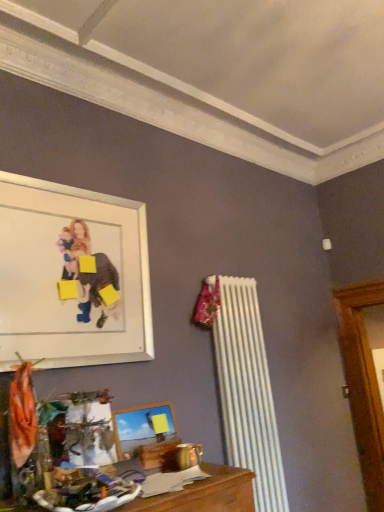
The image size is (384, 512). In order to click on wooden picture frame at lower center, which ranks as the 2th picture frame in top-to-bottom order in this screenshot , I will do `click(142, 426)`.

The width and height of the screenshot is (384, 512). What do you see at coordinates (142, 426) in the screenshot?
I see `wooden picture frame at lower center, which ranks as the 2th picture frame in top-to-bottom order` at bounding box center [142, 426].

Locate an element on the screen. white matte picture frame at upper left, marked as the first picture frame in a top-to-bottom arrangement is located at coordinates (71, 276).

What do you see at coordinates (71, 276) in the screenshot? I see `white matte picture frame at upper left, the second picture frame when ordered from bottom to top` at bounding box center [71, 276].

Where is `wooden picture frame at lower center, which ranks as the 2th picture frame in top-to-bottom order`? The image size is (384, 512). wooden picture frame at lower center, which ranks as the 2th picture frame in top-to-bottom order is located at coordinates (142, 426).

Is white matte picture frame at upper left, marked as the first picture frame in a top-to-bottom arrangement, to the right of wooden picture frame at lower center, which is the 1th picture frame from bottom to top, from the viewer's perspective?

No, white matte picture frame at upper left, marked as the first picture frame in a top-to-bottom arrangement, is not to the right of wooden picture frame at lower center, which is the 1th picture frame from bottom to top.

Is white matte picture frame at upper left, marked as the first picture frame in a top-to-bottom arrangement, behind wooden picture frame at lower center, which ranks as the 2th picture frame in top-to-bottom order?

No, it is in front of wooden picture frame at lower center, which ranks as the 2th picture frame in top-to-bottom order.

Which is behind, point (54, 365) or point (132, 437)?

Point (132, 437)

From the image's perspective, is white matte picture frame at upper left, the second picture frame when ordered from bottom to top, on top of wooden picture frame at lower center, which is the 1th picture frame from bottom to top?

Yes, from the image's perspective, white matte picture frame at upper left, the second picture frame when ordered from bottom to top, is over wooden picture frame at lower center, which is the 1th picture frame from bottom to top.

From a real-world perspective, is white matte picture frame at upper left, the second picture frame when ordered from bottom to top, beneath wooden picture frame at lower center, which ranks as the 2th picture frame in top-to-bottom order?

Incorrect, from a real-world perspective, white matte picture frame at upper left, the second picture frame when ordered from bottom to top, is higher than wooden picture frame at lower center, which ranks as the 2th picture frame in top-to-bottom order.

Can you confirm if white matte picture frame at upper left, marked as the first picture frame in a top-to-bottom arrangement, is thinner than wooden picture frame at lower center, which is the 1th picture frame from bottom to top?

Indeed, white matte picture frame at upper left, marked as the first picture frame in a top-to-bottom arrangement, has a lesser width compared to wooden picture frame at lower center, which is the 1th picture frame from bottom to top.

Considering the sizes of objects white matte picture frame at upper left, marked as the first picture frame in a top-to-bottom arrangement, and wooden picture frame at lower center, which is the 1th picture frame from bottom to top, in the image provided, who is shorter, white matte picture frame at upper left, marked as the first picture frame in a top-to-bottom arrangement, or wooden picture frame at lower center, which is the 1th picture frame from bottom to top,?

With less height is wooden picture frame at lower center, which is the 1th picture frame from bottom to top.

Considering the sizes of objects white matte picture frame at upper left, marked as the first picture frame in a top-to-bottom arrangement, and wooden picture frame at lower center, which is the 1th picture frame from bottom to top, in the image provided, who is smaller, white matte picture frame at upper left, marked as the first picture frame in a top-to-bottom arrangement, or wooden picture frame at lower center, which is the 1th picture frame from bottom to top,?

Smaller between the two is wooden picture frame at lower center, which is the 1th picture frame from bottom to top.

Is white matte picture frame at upper left, marked as the first picture frame in a top-to-bottom arrangement, spatially inside wooden picture frame at lower center, which is the 1th picture frame from bottom to top, or outside of it?

white matte picture frame at upper left, marked as the first picture frame in a top-to-bottom arrangement, exists outside the volume of wooden picture frame at lower center, which is the 1th picture frame from bottom to top.

Is white matte picture frame at upper left, marked as the first picture frame in a top-to-bottom arrangement, far away from wooden picture frame at lower center, which ranks as the 2th picture frame in top-to-bottom order?

white matte picture frame at upper left, marked as the first picture frame in a top-to-bottom arrangement, is actually quite close to wooden picture frame at lower center, which ranks as the 2th picture frame in top-to-bottom order.

Is wooden picture frame at lower center, which ranks as the 2th picture frame in top-to-bottom order, at the back of white matte picture frame at upper left, the second picture frame when ordered from bottom to top?

That's not correct — white matte picture frame at upper left, the second picture frame when ordered from bottom to top, is not looking away from wooden picture frame at lower center, which ranks as the 2th picture frame in top-to-bottom order.

How many degrees apart are the facing directions of white matte picture frame at upper left, the second picture frame when ordered from bottom to top, and wooden picture frame at lower center, which is the 1th picture frame from bottom to top?

The angular difference between white matte picture frame at upper left, the second picture frame when ordered from bottom to top, and wooden picture frame at lower center, which is the 1th picture frame from bottom to top, is 0.00225 degrees.

I want to click on picture frame above the wooden picture frame at lower center, which is the 1th picture frame from bottom to top (from a real-world perspective), so click(x=71, y=276).

Is wooden picture frame at lower center, which ranks as the 2th picture frame in top-to-bottom order, to the right of white matte picture frame at upper left, marked as the first picture frame in a top-to-bottom arrangement, from the viewer's perspective?

Yes.

Is wooden picture frame at lower center, which ranks as the 2th picture frame in top-to-bottom order, in front of or behind white matte picture frame at upper left, marked as the first picture frame in a top-to-bottom arrangement, in the image?

wooden picture frame at lower center, which ranks as the 2th picture frame in top-to-bottom order, is behind white matte picture frame at upper left, marked as the first picture frame in a top-to-bottom arrangement.

Which is behind, point (152, 420) or point (134, 255)?

The point (134, 255) is more distant.

From the image's perspective, is wooden picture frame at lower center, which ranks as the 2th picture frame in top-to-bottom order, above white matte picture frame at upper left, marked as the first picture frame in a top-to-bottom arrangement?

No.

From a real-world perspective, which is physically below, wooden picture frame at lower center, which is the 1th picture frame from bottom to top, or white matte picture frame at upper left, marked as the first picture frame in a top-to-bottom arrangement?

wooden picture frame at lower center, which is the 1th picture frame from bottom to top, from a real-world perspective.

Considering the relative sizes of wooden picture frame at lower center, which is the 1th picture frame from bottom to top, and white matte picture frame at upper left, marked as the first picture frame in a top-to-bottom arrangement, in the image provided, is wooden picture frame at lower center, which is the 1th picture frame from bottom to top, thinner than white matte picture frame at upper left, marked as the first picture frame in a top-to-bottom arrangement,?

No, wooden picture frame at lower center, which is the 1th picture frame from bottom to top, is not thinner than white matte picture frame at upper left, marked as the first picture frame in a top-to-bottom arrangement.

Is wooden picture frame at lower center, which is the 1th picture frame from bottom to top, taller than white matte picture frame at upper left, the second picture frame when ordered from bottom to top?

In fact, wooden picture frame at lower center, which is the 1th picture frame from bottom to top, may be shorter than white matte picture frame at upper left, the second picture frame when ordered from bottom to top.

Does wooden picture frame at lower center, which is the 1th picture frame from bottom to top, have a smaller size compared to white matte picture frame at upper left, marked as the first picture frame in a top-to-bottom arrangement?

Yes, wooden picture frame at lower center, which is the 1th picture frame from bottom to top, is smaller than white matte picture frame at upper left, marked as the first picture frame in a top-to-bottom arrangement.

Do you think wooden picture frame at lower center, which ranks as the 2th picture frame in top-to-bottom order, is within white matte picture frame at upper left, the second picture frame when ordered from bottom to top, or outside of it?

wooden picture frame at lower center, which ranks as the 2th picture frame in top-to-bottom order, is not inside white matte picture frame at upper left, the second picture frame when ordered from bottom to top, it's outside.

Is wooden picture frame at lower center, which is the 1th picture frame from bottom to top, next to white matte picture frame at upper left, the second picture frame when ordered from bottom to top, and touching it?

No, wooden picture frame at lower center, which is the 1th picture frame from bottom to top, is not beside white matte picture frame at upper left, the second picture frame when ordered from bottom to top.

Is wooden picture frame at lower center, which is the 1th picture frame from bottom to top, turned away from white matte picture frame at upper left, the second picture frame when ordered from bottom to top?

No.

From the picture: What's the angular difference between wooden picture frame at lower center, which ranks as the 2th picture frame in top-to-bottom order, and white matte picture frame at upper left, the second picture frame when ordered from bottom to top,'s facing directions?

The facing directions of wooden picture frame at lower center, which ranks as the 2th picture frame in top-to-bottom order, and white matte picture frame at upper left, the second picture frame when ordered from bottom to top, are 0.00225 degrees apart.

Where is `picture frame above the wooden picture frame at lower center, which ranks as the 2th picture frame in top-to-bottom order (from the image's perspective)`? This screenshot has width=384, height=512. picture frame above the wooden picture frame at lower center, which ranks as the 2th picture frame in top-to-bottom order (from the image's perspective) is located at coordinates (71, 276).

You are a GUI agent. You are given a task and a screenshot of the screen. Output one action in this format:
    pyautogui.click(x=<x>, y=<y>)
    Task: Click on the picture frame in front of the wooden picture frame at lower center, which ranks as the 2th picture frame in top-to-bottom order
    The height and width of the screenshot is (512, 384).
    Given the screenshot: What is the action you would take?
    pyautogui.click(x=71, y=276)

You are a GUI agent. You are given a task and a screenshot of the screen. Output one action in this format:
    pyautogui.click(x=<x>, y=<y>)
    Task: Click on the picture frame below the white matte picture frame at upper left, the second picture frame when ordered from bottom to top (from a real-world perspective)
    The height and width of the screenshot is (512, 384).
    Given the screenshot: What is the action you would take?
    pyautogui.click(x=142, y=426)